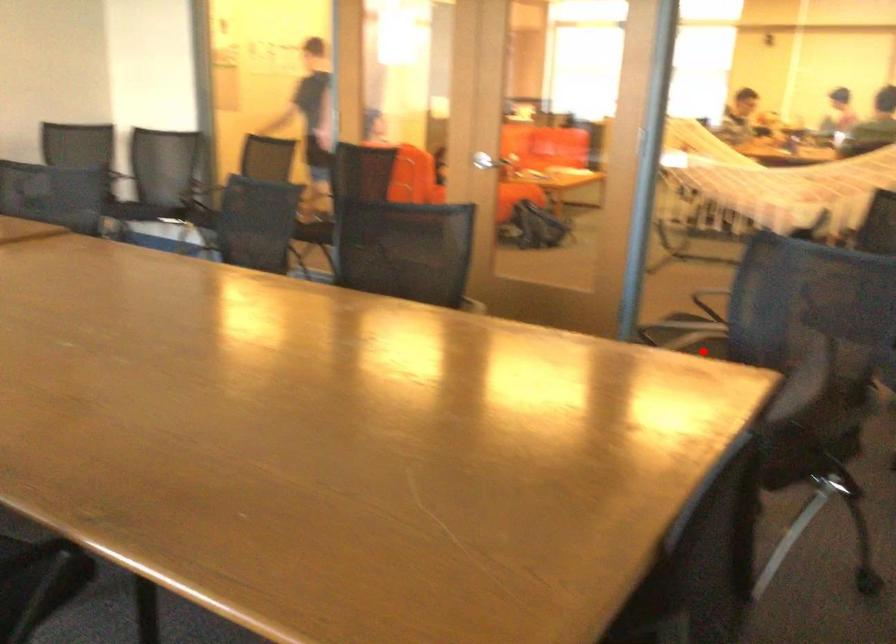
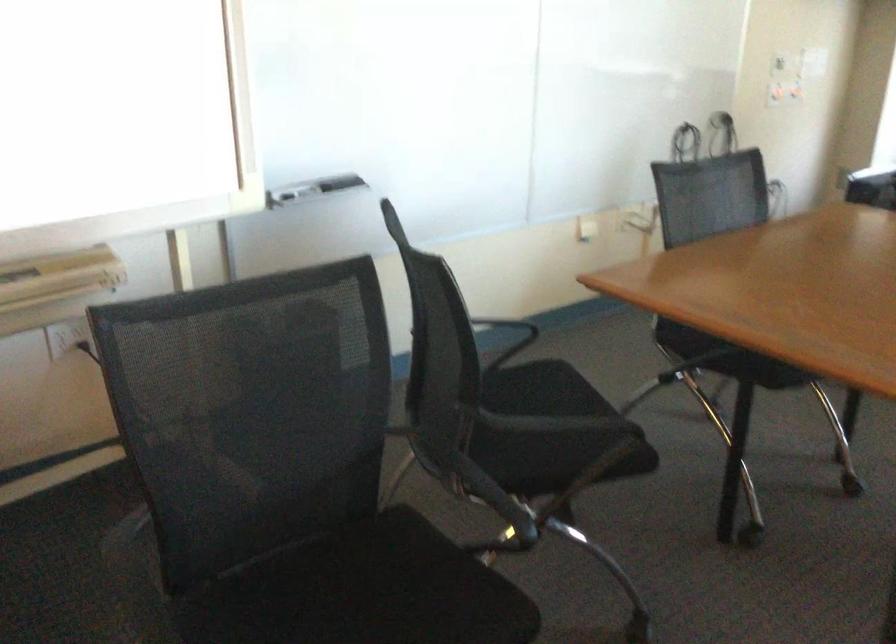
Locate, in the second image, the point that corresponds to the highlighted location in the first image.

(363, 592)